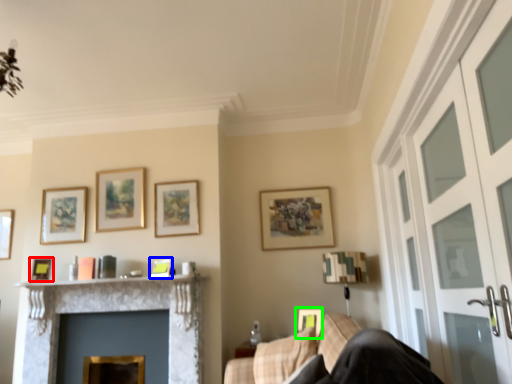
Question: Which is nearer to the picture frame (highlighted by a red box)? picture frame (highlighted by a blue box) or picture frame (highlighted by a green box).

Choices:
 (A) picture frame
 (B) picture frame

Answer: (A)